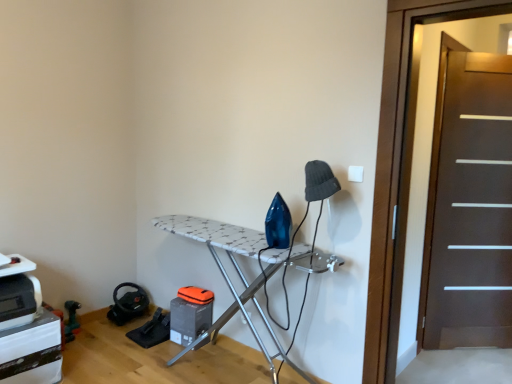
Question: From the image's perspective, would you say white textured ironing board at center is positioned over dark brown wood screen door at right, positioned as the first screen door in right-to-left order?

Choices:
 (A) yes
 (B) no

Answer: (B)

Question: Is white textured ironing board at center aimed at dark brown wood screen door at right, positioned as the first screen door in right-to-left order?

Choices:
 (A) yes
 (B) no

Answer: (B)

Question: From the image's perspective, is white textured ironing board at center beneath dark brown wood screen door at right, which is counted as the second screen door, starting from the front?

Choices:
 (A) no
 (B) yes

Answer: (B)

Question: Is white textured ironing board at center wider than dark brown wood screen door at right, the second screen door from the left?

Choices:
 (A) no
 (B) yes

Answer: (B)

Question: Is dark brown wood screen door at right, positioned as the first screen door in right-to-left order, located within white textured ironing board at center?

Choices:
 (A) no
 (B) yes

Answer: (A)

Question: Is white textured ironing board at center inside the boundaries of dark brown wooden screen door at right, arranged as the second screen door when viewed from the right, or outside?

Choices:
 (A) outside
 (B) inside

Answer: (A)

Question: In terms of height, does white textured ironing board at center look taller or shorter compared to dark brown wooden screen door at right, arranged as the second screen door when viewed from the right?

Choices:
 (A) short
 (B) tall

Answer: (A)

Question: Considering the positions of point (214, 226) and point (381, 233), is point (214, 226) closer or farther from the camera than point (381, 233)?

Choices:
 (A) closer
 (B) farther

Answer: (B)

Question: Looking at the image, does white textured ironing board at center seem bigger or smaller compared to dark brown wooden screen door at right, the 2th screen door when ordered from back to front?

Choices:
 (A) small
 (B) big

Answer: (B)

Question: From a real-world perspective, relative to dark brown wood screen door at right, positioned as the first screen door in right-to-left order, is dark brown wooden screen door at right, acting as the first screen door starting from the front, vertically above or below?

Choices:
 (A) below
 (B) above

Answer: (B)

Question: In terms of height, does dark brown wooden screen door at right, the 2th screen door when ordered from back to front, look taller or shorter compared to dark brown wood screen door at right, which is the first screen door from back to front?

Choices:
 (A) short
 (B) tall

Answer: (B)

Question: Considering the relative positions of dark brown wooden screen door at right, acting as the first screen door starting from the front, and dark brown wood screen door at right, which is the first screen door from back to front, in the image provided, is dark brown wooden screen door at right, acting as the first screen door starting from the front, to the left or to the right of dark brown wood screen door at right, which is the first screen door from back to front,?

Choices:
 (A) left
 (B) right

Answer: (A)

Question: Do you think dark brown wooden screen door at right, acting as the first screen door starting from the front, is within dark brown wood screen door at right, which is counted as the second screen door, starting from the front, or outside of it?

Choices:
 (A) outside
 (B) inside

Answer: (A)

Question: Would you say dark brown wood screen door at right, which is the first screen door from back to front, is to the left or to the right of white textured ironing board at center in the picture?

Choices:
 (A) left
 (B) right

Answer: (B)

Question: Is dark brown wood screen door at right, which is the first screen door from back to front, spatially inside white textured ironing board at center, or outside of it?

Choices:
 (A) outside
 (B) inside

Answer: (A)